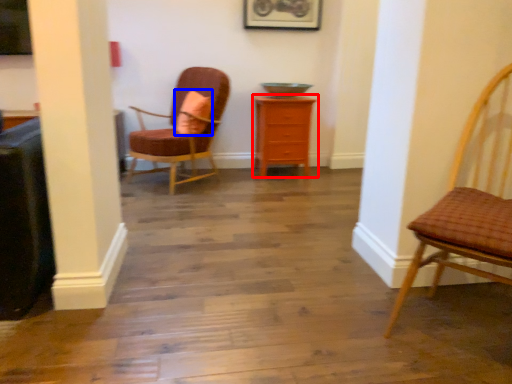
Question: Which object is further to the camera taking this photo, chest of drawers (highlighted by a red box) or pillow (highlighted by a blue box)?

Choices:
 (A) chest of drawers
 (B) pillow

Answer: (A)